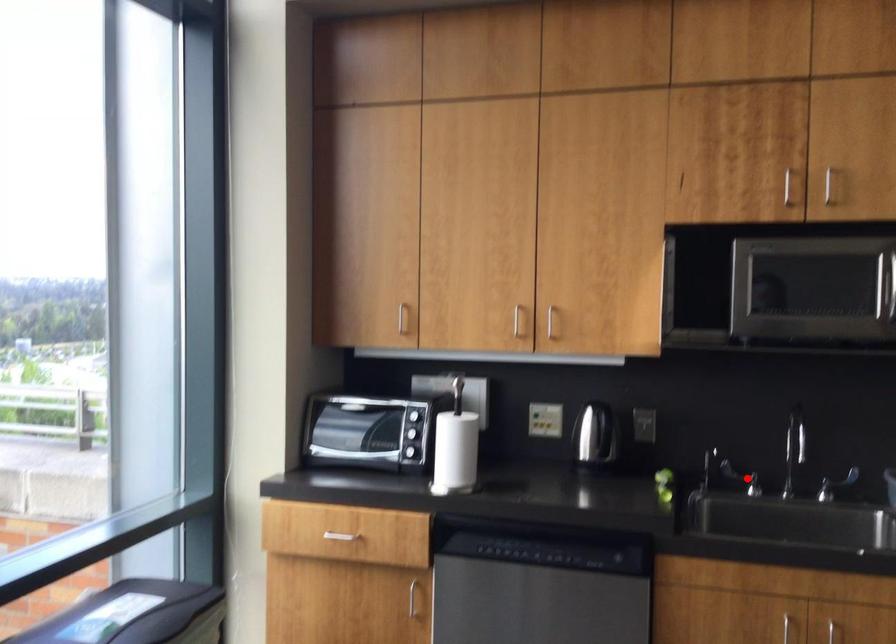
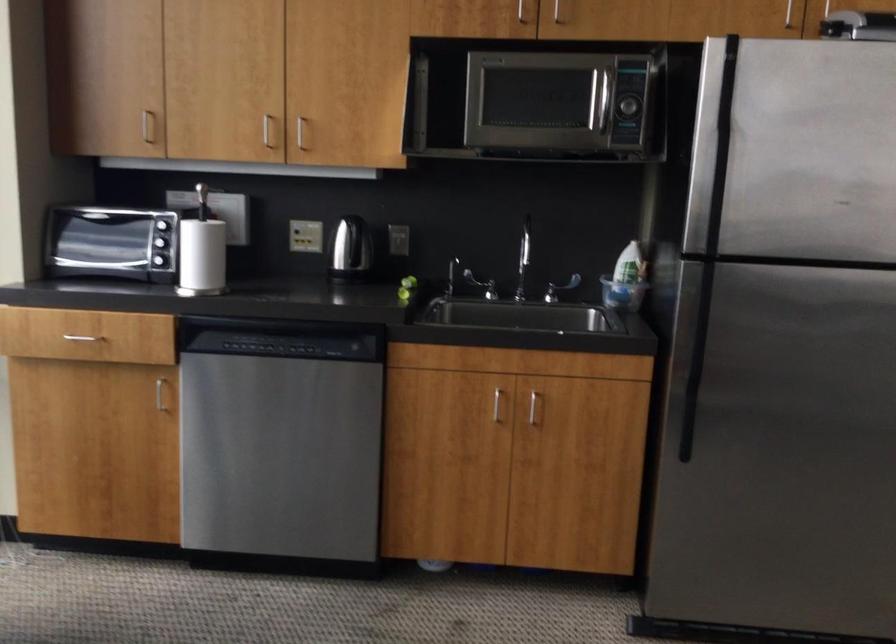
Question: I am providing you with two images of the same scene from different viewpoints. Image1 has a red point marked. In image2, the corresponding 3D location appears at what relative position? Reply with the corresponding letter.

Choices:
 (A) Closer
 (B) Farther

Answer: (B)